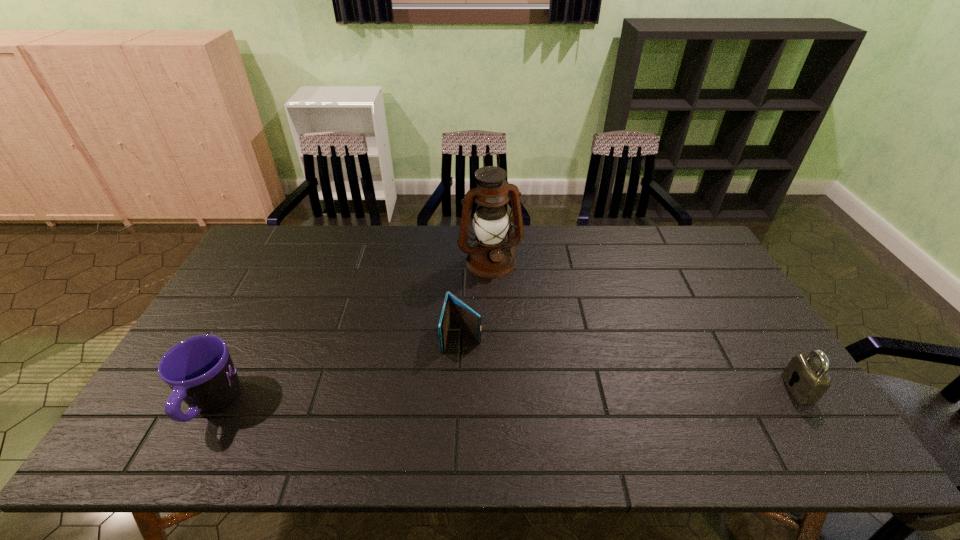
The image size is (960, 540). What are the coordinates of `the leftmost object` in the screenshot? It's located at (200, 371).

Locate an element on the screen. This screenshot has height=540, width=960. the rightmost object is located at coordinates (810, 381).

Image resolution: width=960 pixels, height=540 pixels. I want to click on the farthest object, so click(490, 256).

Locate an element on the screen. lantern is located at coordinates (490, 256).

Locate an element on the screen. This screenshot has height=540, width=960. the shortest object is located at coordinates (454, 310).

At what (x,y) coordinates should I click in order to perform the action: click on the second farthest object. Please return your answer as a coordinate pair (x, y). This screenshot has width=960, height=540. Looking at the image, I should click on (454, 310).

This screenshot has height=540, width=960. Identify the location of free point located at the front of the rightmost object near the keyhole. (756, 388).

Locate an element on the screen. This screenshot has width=960, height=540. vacant region located at the front of the rightmost object near the keyhole is located at coordinates (712, 388).

Locate an element on the screen. The width and height of the screenshot is (960, 540). vacant area situated at the front of the rightmost object near the keyhole is located at coordinates (645, 388).

Find the location of a particular element. The image size is (960, 540). vacant space located on the side of the lantern, there is a wick adjustment knob is located at coordinates (516, 319).